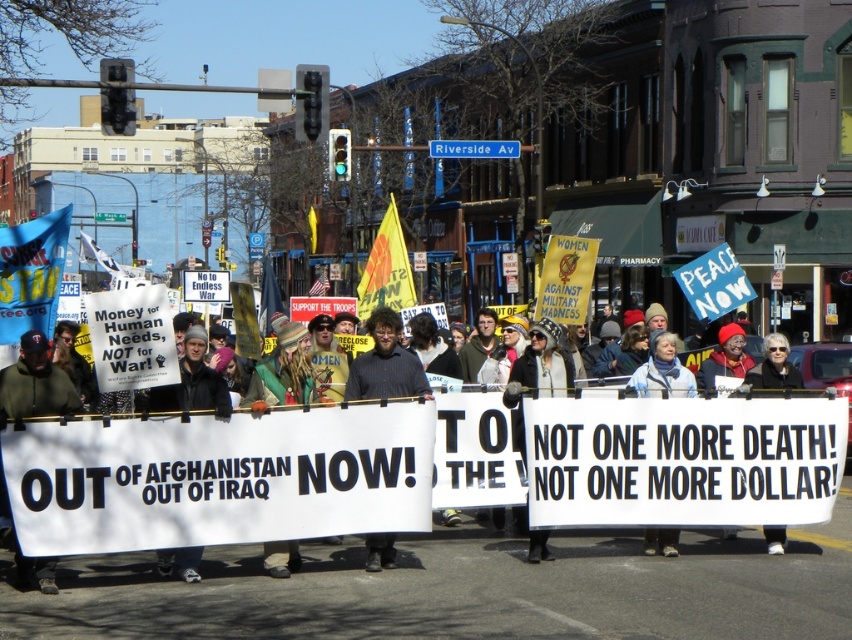
Is white paper banner at center closer to camera compared to white fabric sign at lower right?

Yes, it is in front of white fabric sign at lower right.

Does white paper banner at center have a lesser width compared to white fabric sign at lower right?

No, white paper banner at center is not thinner than white fabric sign at lower right.

Who is more distant from viewer, (223,358) or (757,380)?

Point (223,358)

Where is `white paper banner at center`? The width and height of the screenshot is (852, 640). white paper banner at center is located at coordinates (159, 353).

Can you confirm if dark gray shirt at center is thinner than black leather jacket at center?

Incorrect, dark gray shirt at center's width is not less than black leather jacket at center's.

Between dark gray shirt at center and black leather jacket at center, which one appears on the right side from the viewer's perspective?

From the viewer's perspective, black leather jacket at center appears more on the right side.

Locate an element on the screen. dark gray shirt at center is located at coordinates (384, 364).

Does white fabric sign at center have a larger size compared to white fabric sign at lower right?

Yes, white fabric sign at center is bigger than white fabric sign at lower right.

From the picture: Which of these two, white fabric sign at center or white fabric sign at lower right, stands shorter?

white fabric sign at lower right

Between point (668, 385) and point (780, 381), which one is positioned behind?

The point (780, 381) is more distant.

This screenshot has height=640, width=852. Find the location of `white fabric sign at center`. white fabric sign at center is located at coordinates (661, 371).